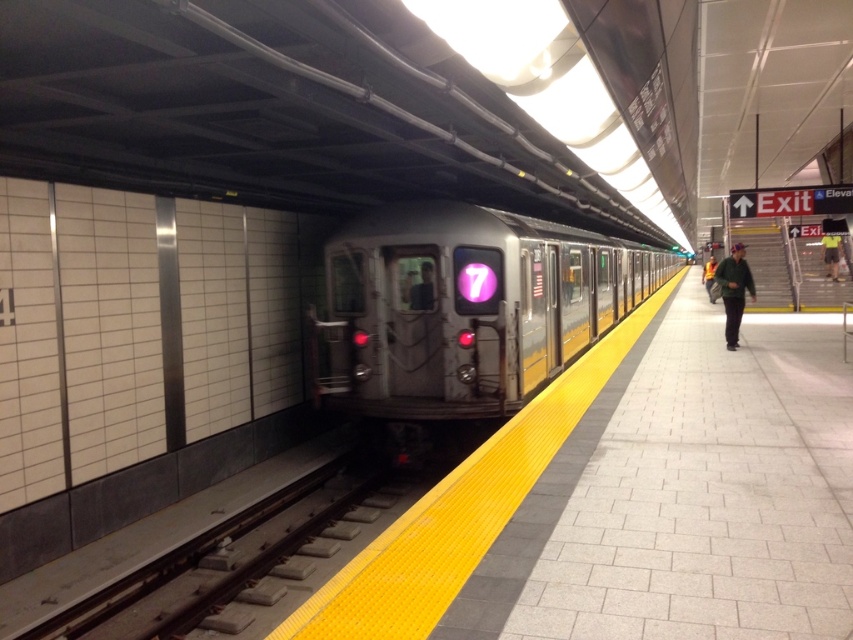
Question: Can you confirm if yellow-cotton shirt at right is smaller than yellow reflective vest at center?

Choices:
 (A) yes
 (B) no

Answer: (A)

Question: Based on their relative distances, which object is farther from the green fabric jacket at right?

Choices:
 (A) yellow reflective vest at center
 (B) yellow-cotton shirt at right
 (C) silver metallic train at center

Answer: (A)

Question: Which object appears farthest from the camera in this image?

Choices:
 (A) yellow reflective vest at center
 (B) green fabric jacket at right
 (C) silver metallic train at center

Answer: (A)

Question: Is silver metallic train at center smaller than yellow reflective vest at center?

Choices:
 (A) yes
 (B) no

Answer: (B)

Question: Which of the following is the farthest from the observer?

Choices:
 (A) yellow-cotton shirt at right
 (B) green fabric jacket at right
 (C) silver metallic train at center

Answer: (A)

Question: Is silver metallic train at center behind green fabric jacket at right?

Choices:
 (A) yes
 (B) no

Answer: (B)